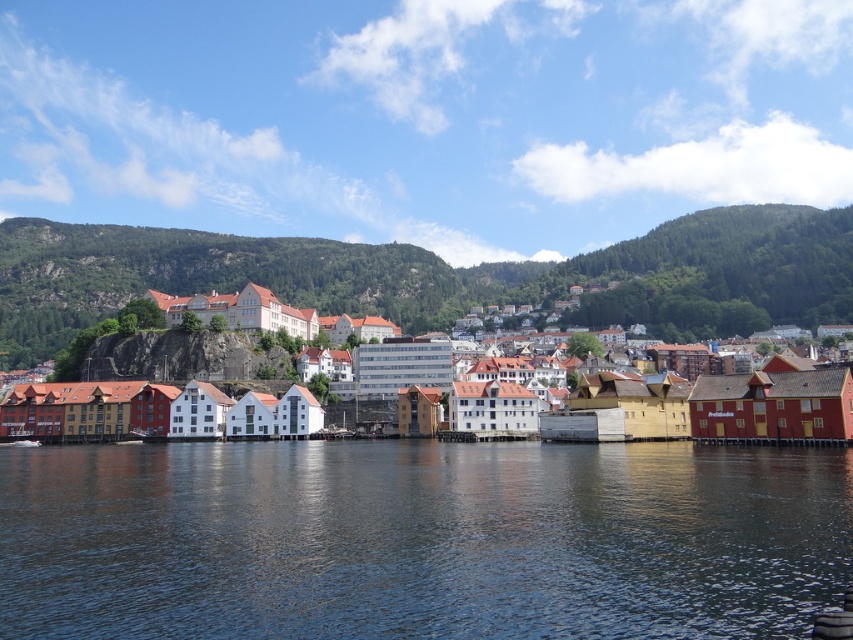
Question: Which of the following is the farthest from the observer?

Choices:
 (A) green forested mountain at upper center
 (B) white wooden buildings at center
 (C) transparent water at center

Answer: (A)

Question: Can you confirm if transparent water at center is bigger than green forested mountain at upper center?

Choices:
 (A) no
 (B) yes

Answer: (A)

Question: Which point is farther to the camera?

Choices:
 (A) (691, 372)
 (B) (344, 464)

Answer: (A)

Question: Which point appears closest to the camera in this image?

Choices:
 (A) (375, 264)
 (B) (158, 433)

Answer: (B)

Question: Is transparent water at center to the left of white wooden buildings at center from the viewer's perspective?

Choices:
 (A) yes
 (B) no

Answer: (A)

Question: Is transparent water at center smaller than white wooden buildings at center?

Choices:
 (A) yes
 (B) no

Answer: (A)